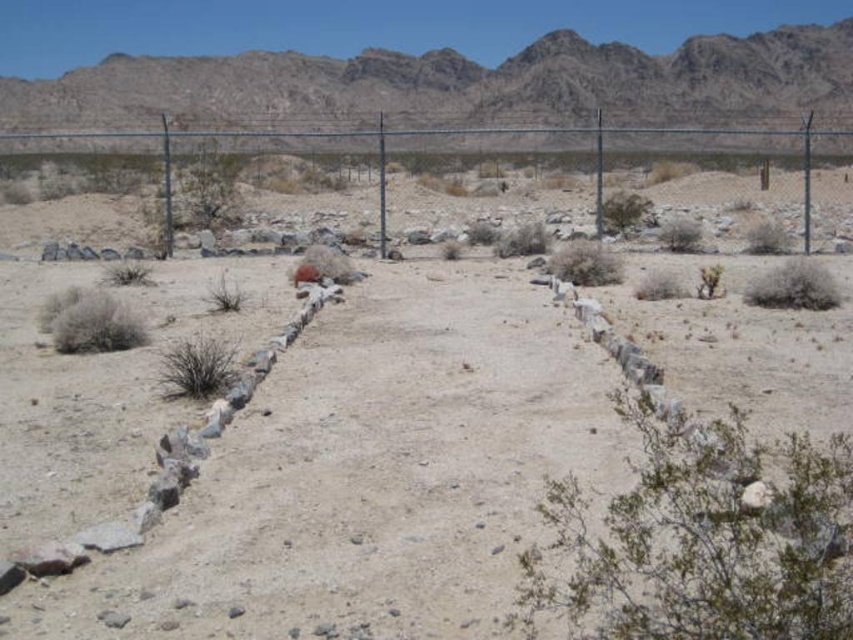
You are standing at the point marked as point (367, 474) in the image. What is the terrain like at that location?

The terrain at point (367, 474) is a dull gray dirt field at center.

You are a hiker carrying a 10kg backpack and want to reach the rugged rock mountain at upper center from the dull gray dirt field at center. Considering the distance between them, do you think it is feasible to walk directly to the mountain without any obstacles?

The distance between the dull gray dirt field at center and the rugged rock mountain at upper center is 25.62 meters. Since the distance is relatively short and there are no mentioned obstacles in the scene, it is feasible to walk directly to the mountain.